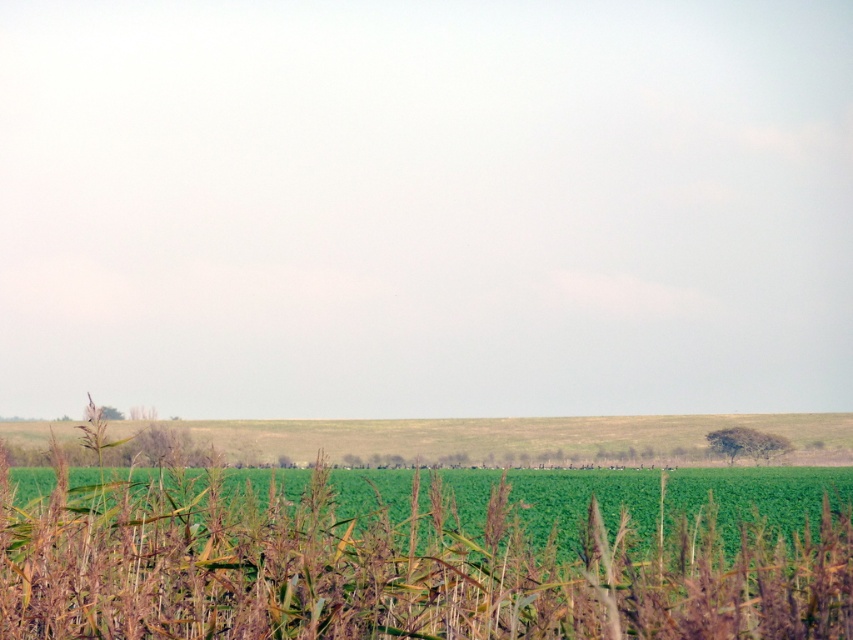
In the scene shown: You are standing in the rural landscape and want to walk towards the green grass at lower center. Which direction should you move relative to the green matte corn field at center?

You should move to the right relative to the green matte corn field at center because the green matte corn field at center is to the left of the green grass at lower center.

You are a farmer planning to plant new crops. You observe the green matte corn field at center and the green grass at lower center in the image. Which area would you prioritize for planting if you want to maximize the space used for crops?

The green grass at lower center occupies more space than the green matte corn field at center, so prioritizing planting in the green grass at lower center would allow for more space to be utilized for crops.